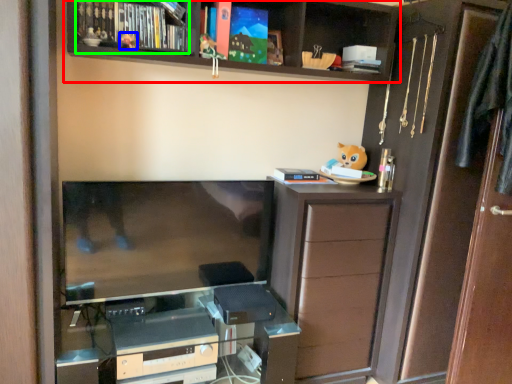
Question: Estimate the real-world distances between objects in this image. Which object is closer to shelf (highlighted by a red box), toy (highlighted by a blue box) or book (highlighted by a green box)?

Choices:
 (A) toy
 (B) book

Answer: (B)